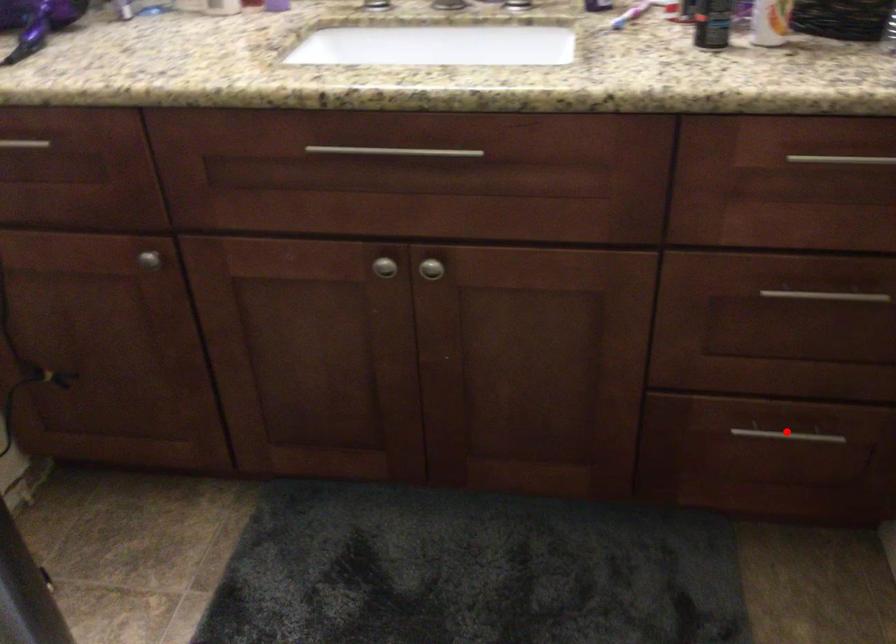
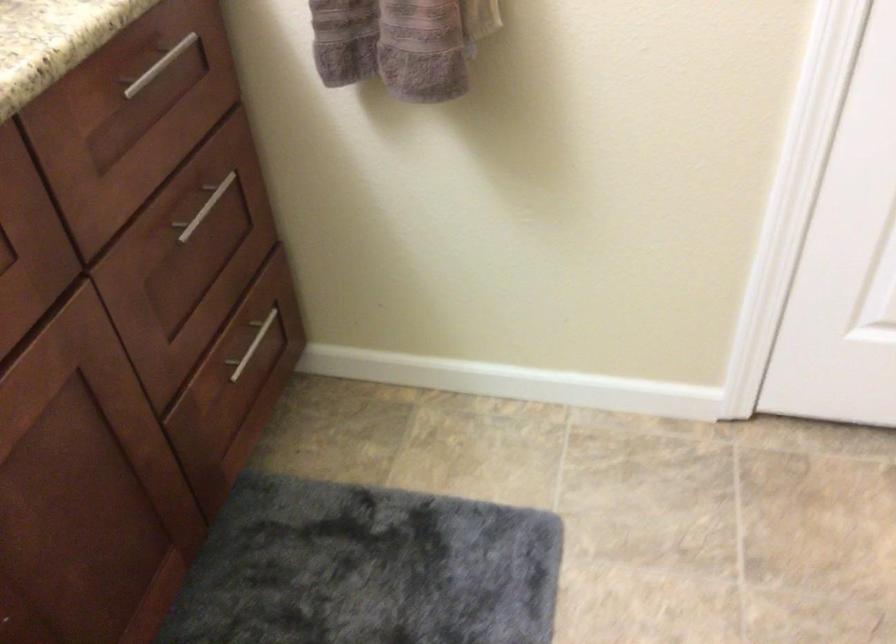
Where in the second image is the point corresponding to the highlighted location from the first image?

(252, 345)